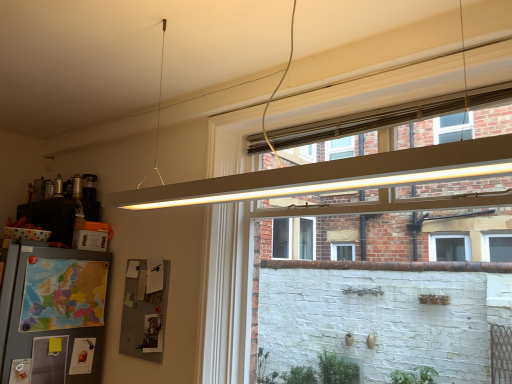
Question: Is matte white frame at upper center facing away from gray fabric bulletin board at lower left?

Choices:
 (A) yes
 (B) no

Answer: (B)

Question: Does matte white frame at upper center come in front of gray fabric bulletin board at lower left?

Choices:
 (A) yes
 (B) no

Answer: (A)

Question: From a real-world perspective, is matte white frame at upper center over gray fabric bulletin board at lower left?

Choices:
 (A) no
 (B) yes

Answer: (B)

Question: Is matte white frame at upper center positioned far away from gray fabric bulletin board at lower left?

Choices:
 (A) no
 (B) yes

Answer: (A)

Question: Is matte white frame at upper center located outside gray fabric bulletin board at lower left?

Choices:
 (A) yes
 (B) no

Answer: (A)

Question: From the image's perspective, is matte white frame at upper center over gray fabric bulletin board at lower left?

Choices:
 (A) yes
 (B) no

Answer: (A)

Question: Is gray fabric bulletin board at lower left positioned far away from matte white frame at upper center?

Choices:
 (A) no
 (B) yes

Answer: (A)

Question: Is gray fabric bulletin board at lower left turned away from matte white frame at upper center?

Choices:
 (A) no
 (B) yes

Answer: (A)

Question: From the image's perspective, is gray fabric bulletin board at lower left on top of matte white frame at upper center?

Choices:
 (A) no
 (B) yes

Answer: (A)

Question: Does gray fabric bulletin board at lower left have a lesser width compared to matte white frame at upper center?

Choices:
 (A) yes
 (B) no

Answer: (A)

Question: Is gray fabric bulletin board at lower left outside of matte white frame at upper center?

Choices:
 (A) yes
 (B) no

Answer: (A)

Question: Is gray fabric bulletin board at lower left oriented towards matte white frame at upper center?

Choices:
 (A) yes
 (B) no

Answer: (B)

Question: Considering the positions of point [244, 226] and point [159, 276], is point [244, 226] closer or farther from the camera than point [159, 276]?

Choices:
 (A) closer
 (B) farther

Answer: (A)